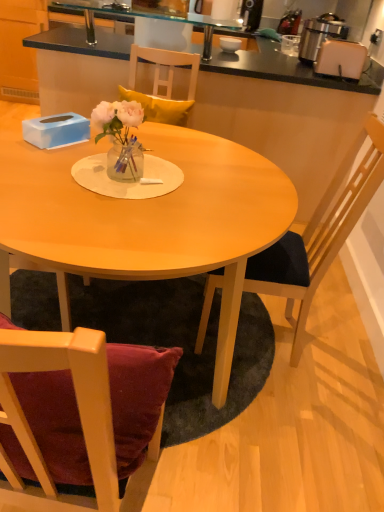
Identify the location of free spot behind clear glass vase at center. (148, 153).